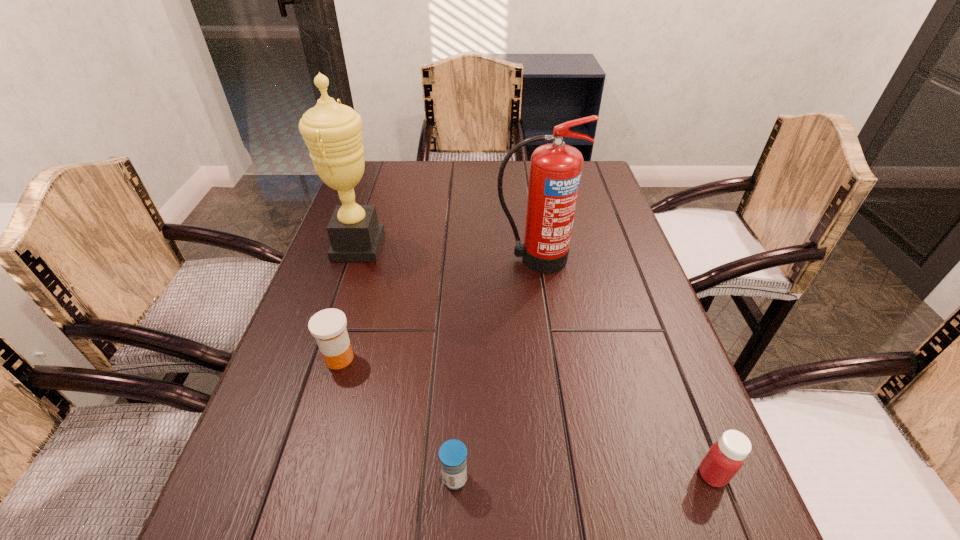
This screenshot has height=540, width=960. Find the location of `empty location between the leftmost medicine and the trophy cup`. empty location between the leftmost medicine and the trophy cup is located at coordinates (348, 302).

Find the location of `vacant area that lies between the farthest medicine and the tallest object`. vacant area that lies between the farthest medicine and the tallest object is located at coordinates (348, 302).

Locate an element on the screen. This screenshot has height=540, width=960. unoccupied area between the fire extinguisher and the rightmost object is located at coordinates (623, 367).

At what (x,y) coordinates should I click in order to perform the action: click on vacant area that lies between the trophy cup and the fourth object from left to right. Please return your answer as a coordinate pair (x, y). Image resolution: width=960 pixels, height=540 pixels. Looking at the image, I should click on (446, 253).

In order to click on vacant area that lies between the third object from left to right and the fourth shortest object in this screenshot , I will do `click(494, 369)`.

Where is `free space that is in between the rightmost medicine and the leftmost medicine`? This screenshot has width=960, height=540. free space that is in between the rightmost medicine and the leftmost medicine is located at coordinates (526, 416).

Identify the location of vacant region between the shortest object and the fire extinguisher. This screenshot has height=540, width=960. (494, 369).

This screenshot has width=960, height=540. In order to click on free spot between the fourth object from left to right and the tallest object in this screenshot , I will do `click(446, 253)`.

Where is `free spot between the rightmost medicine and the fire extinguisher`? The image size is (960, 540). free spot between the rightmost medicine and the fire extinguisher is located at coordinates (623, 367).

The image size is (960, 540). I want to click on object that ranks as the second closest to the tallest object, so click(x=555, y=171).